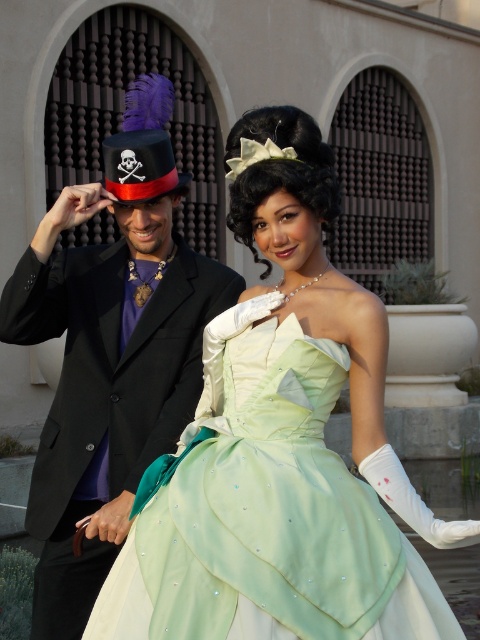
Is lime satin dress at center positioned before shiny black top hat at upper left?

That is True.

Between lime satin dress at center and shiny black top hat at upper left, which one has less height?

With less height is lime satin dress at center.

Between point (357, 611) and point (36, 595), which one is positioned behind?

The point (36, 595) is more distant.

Locate an element on the screen. This screenshot has height=640, width=480. lime satin dress at center is located at coordinates (274, 509).

Who is higher up, lime satin dress at center or matte black dress hat with skull and crossbones at upper left?

Positioned higher is matte black dress hat with skull and crossbones at upper left.

Between lime satin dress at center and matte black dress hat with skull and crossbones at upper left, which one is positioned lower?

lime satin dress at center is below.

What do you see at coordinates (274, 509) in the screenshot? This screenshot has height=640, width=480. I see `lime satin dress at center` at bounding box center [274, 509].

Locate an element on the screen. This screenshot has width=480, height=640. lime satin dress at center is located at coordinates (274, 509).

Can you confirm if shiny black top hat at upper left is thinner than matte black dress hat with skull and crossbones at upper left?

No.

Between shiny black top hat at upper left and matte black dress hat with skull and crossbones at upper left, which one has less height?

matte black dress hat with skull and crossbones at upper left is shorter.

This screenshot has width=480, height=640. I want to click on shiny black top hat at upper left, so pyautogui.click(x=110, y=353).

The image size is (480, 640). I want to click on shiny black top hat at upper left, so pos(110,353).